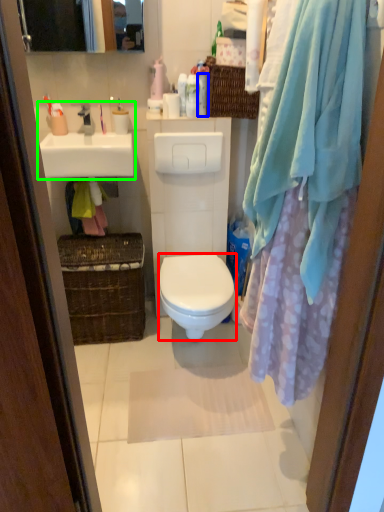
Question: Based on their relative distances, which object is nearer to bidet (highlighted by a red box)? Choose from toiletry (highlighted by a blue box) and sink (highlighted by a green box).

Choices:
 (A) toiletry
 (B) sink

Answer: (B)